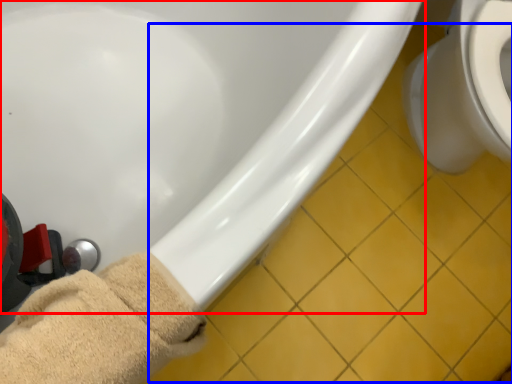
Question: Which object appears closest to the camera in this image, bathtub (highlighted by a red box) or tile (highlighted by a blue box)?

Choices:
 (A) bathtub
 (B) tile

Answer: (A)